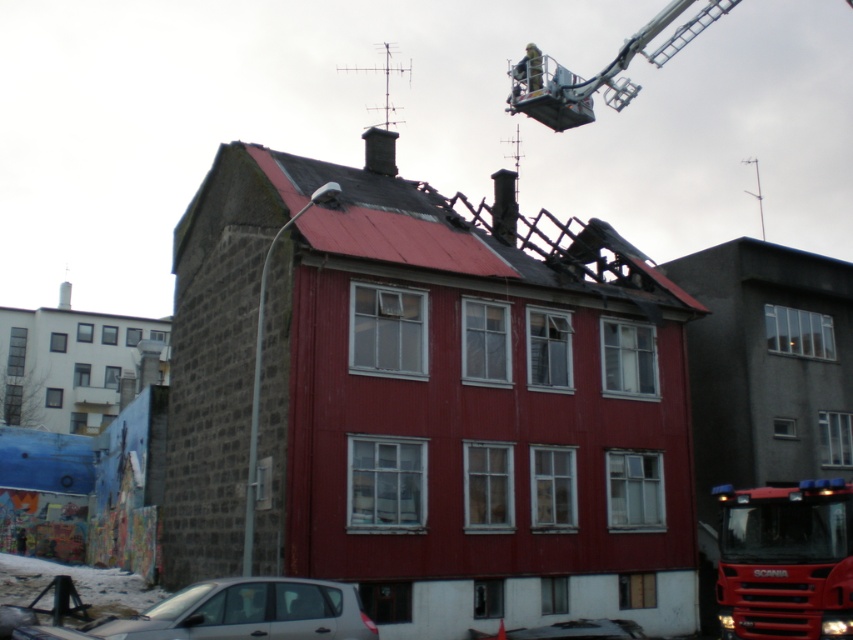
Question: Which of the following is the closest to the observer?

Choices:
 (A) silver metallic car at lower left
 (B) smooth gray chimney at center

Answer: (A)

Question: Which of these objects is positioned closest to the metallic silver crane at upper center?

Choices:
 (A) smooth gray chimney at center
 (B) red slate roof at upper center

Answer: (B)

Question: Observing the image, what is the correct spatial positioning of red glossy fire truck at lower right in reference to smooth gray chimney at center?

Choices:
 (A) above
 (B) below

Answer: (B)

Question: From the image, what is the correct spatial relationship of red slate roof at upper center in relation to smooth gray chimney at center?

Choices:
 (A) below
 (B) above

Answer: (A)

Question: Is silver metallic car at lower left wider than metallic silver car at lower center?

Choices:
 (A) yes
 (B) no

Answer: (A)

Question: Estimate the real-world distances between objects in this image. Which object is closer to the red slate roof at upper center?

Choices:
 (A) smooth gray chimney at center
 (B) smooth stone chimney at upper center
 (C) red glossy fire truck at lower right

Answer: (B)